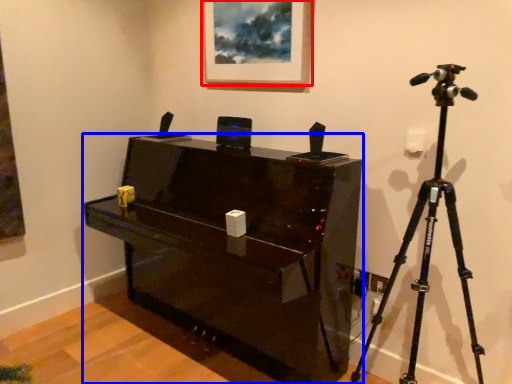
Question: Among these objects, which one is farthest to the camera, picture frame (highlighted by a red box) or furniture (highlighted by a blue box)?

Choices:
 (A) picture frame
 (B) furniture

Answer: (A)